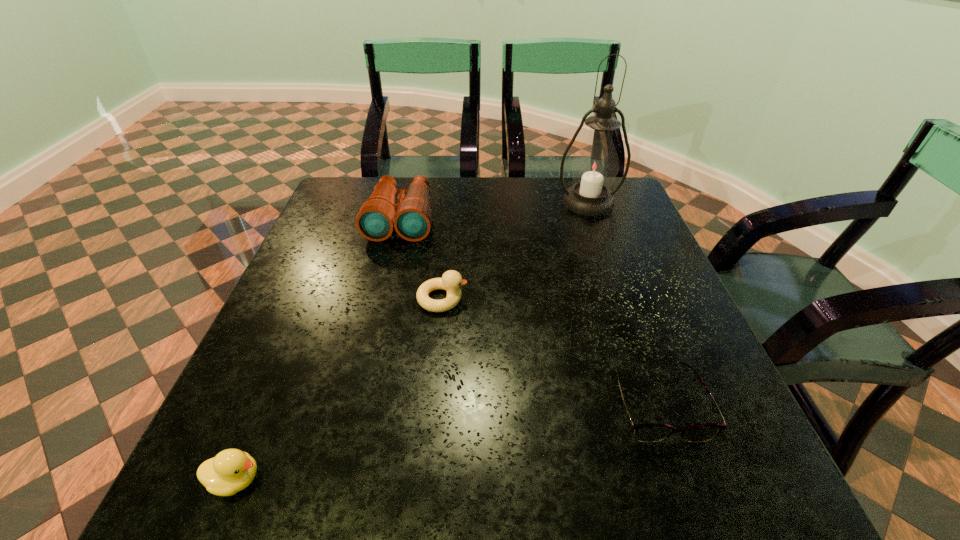
At what (x,y) coordinates should I click in order to perform the action: click on free space located at the beak of the right duckling. Please return your answer as a coordinate pair (x, y). The image size is (960, 540). Looking at the image, I should click on (558, 299).

The height and width of the screenshot is (540, 960). I want to click on free spot located on the beak of the nearer duckling, so click(x=426, y=480).

The width and height of the screenshot is (960, 540). Find the location of `free region located 0.050m on the face of the spectacles`. free region located 0.050m on the face of the spectacles is located at coordinates (683, 473).

You are a GUI agent. You are given a task and a screenshot of the screen. Output one action in this format:
    pyautogui.click(x=<x>, y=<y>)
    Task: Click on the oil lamp that is at the far edge
    Image resolution: width=960 pixels, height=540 pixels.
    Given the screenshot: What is the action you would take?
    pyautogui.click(x=595, y=165)

Where is `binoculars that is at the far edge`? binoculars that is at the far edge is located at coordinates (411, 217).

At what (x,y) coordinates should I click in order to perform the action: click on object present at the near edge. Please return your answer as a coordinate pair (x, y). The width and height of the screenshot is (960, 540). Looking at the image, I should click on (232, 470).

I want to click on binoculars that is positioned at the left edge, so coord(411,217).

This screenshot has height=540, width=960. In order to click on duckling situated at the left edge in this screenshot , I will do tap(232, 470).

This screenshot has height=540, width=960. What are the coordinates of `oil lamp located in the right edge section of the desktop` in the screenshot? It's located at 595,165.

The height and width of the screenshot is (540, 960). In order to click on spectacles that is at the right edge in this screenshot , I will do `click(648, 432)`.